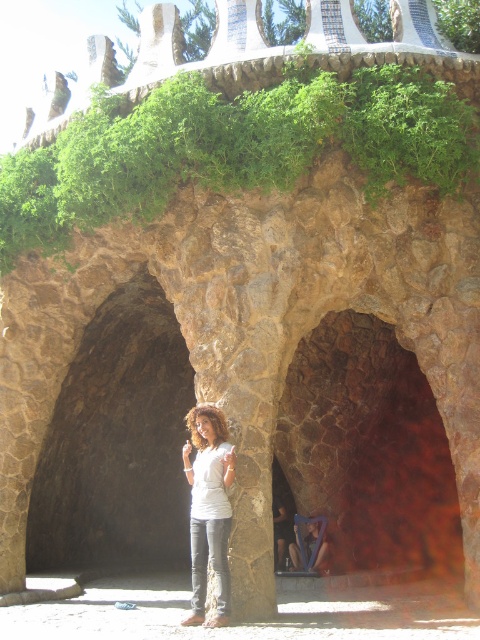
You are a photographer planning to take a portrait of someone standing in front of the rustic stone arch at center. The person will wear a white matte shirt at center. Considering the size of the arch compared to the shirt, how will the arch appear in the photo?

The rustic stone arch at center is much taller than the white matte shirt at center, so in the photo, the arch will appear significantly larger and more dominant compared to the white matte shirt at center.

You are a photographer planning to take a portrait of the person in the scene. The rustic stone arch at center and the white matte shirt at center are both visible in your frame. Which object should you focus on to ensure the subject is properly centered and in focus?

You should focus on the white matte shirt at center because the rustic stone arch at center is smaller in size, making the shirt the more prominent subject for the portrait.

You are a photographer planning to capture the rustic stone arch at center and the white matte shirt at center in a single frame. Based on their positions, can you ensure both elements will be visible in the shot?

The rustic stone arch at center is above the white matte shirt at center, so yes, both elements can be captured in the same frame as they are vertically aligned.